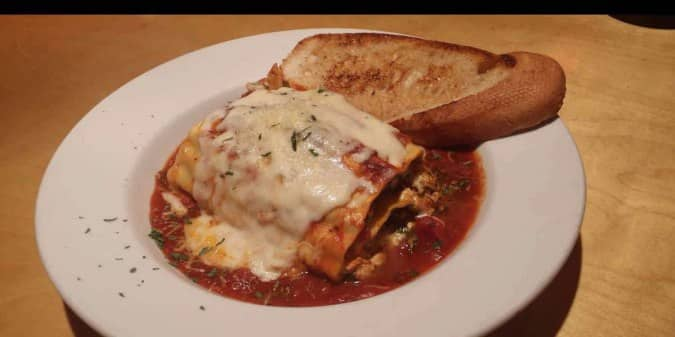
The width and height of the screenshot is (675, 337). In order to click on table in this screenshot , I will do `click(80, 79)`.